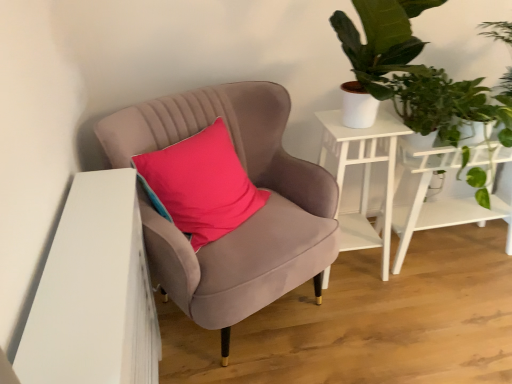
Question: Is green leafy plant at upper right situated inside velvet pink pillow at center or outside?

Choices:
 (A) outside
 (B) inside

Answer: (A)

Question: From a real-world perspective, is green leafy plant at upper right physically located above or below velvet pink pillow at center?

Choices:
 (A) below
 (B) above

Answer: (B)

Question: Based on their relative distances, which object is nearer to the white wood side table at upper right, arranged as the 1th table when viewed from the left?

Choices:
 (A) green leafy plant at upper right
 (B) white matte table at right, positioned as the second table in left-to-right order
 (C) velvet pink pillow at center
 (D) velvet pink chair at center
 (E) green leafy plant at upper right

Answer: (B)

Question: Which object is positioned farthest from the velvet pink chair at center?

Choices:
 (A) white matte table at right, positioned as the second table in left-to-right order
 (B) white wood side table at upper right, arranged as the 1th table when viewed from the left
 (C) green leafy plant at upper right
 (D) velvet pink pillow at center
 (E) green leafy plant at upper right

Answer: (A)